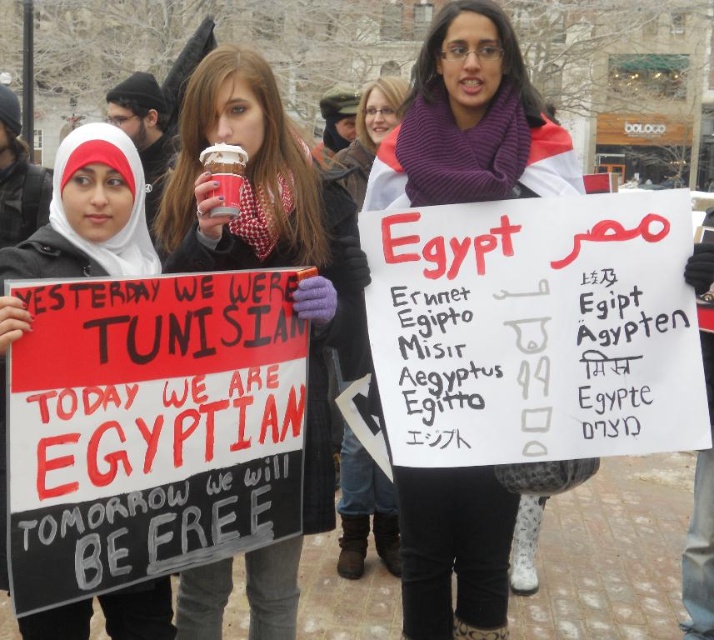
What is the exact 2D coordinate of the matte red cup at center in the image?

The exact 2D coordinate of the matte red cup at center is at point [261,227].

Based on the photo, you are a photographer trying to capture both the matte red cup at center and the white fabric hijab at upper left in a single frame. Based on their sizes, which object should you focus on first to ensure both are in focus?

The matte red cup at center is smaller than the white fabric hijab at upper left. To ensure both are in focus, you should focus on the smaller matte red cup at center first.